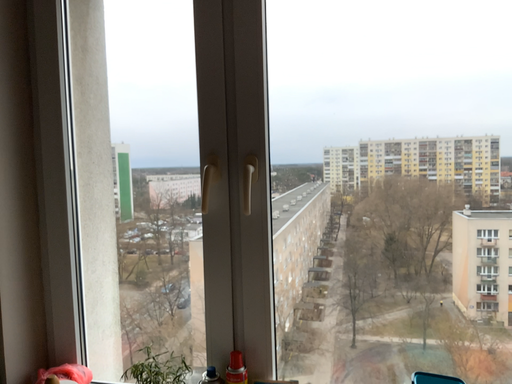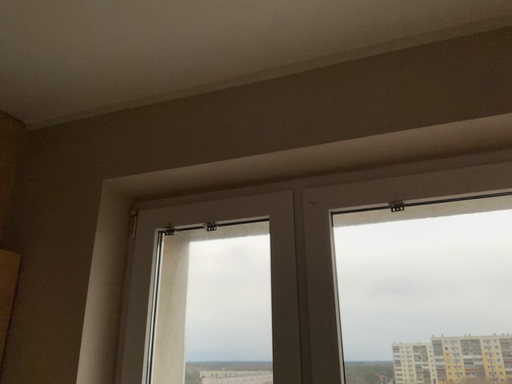
Question: How did the camera likely rotate when shooting the video?

Choices:
 (A) rotated left
 (B) rotated right

Answer: (A)